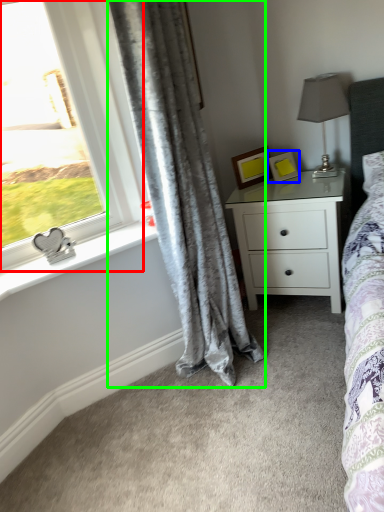
Question: Estimate the real-world distances between objects in this image. Which object is closer to window (highlighted by a red box), picture frame (highlighted by a blue box) or curtain (highlighted by a green box)?

Choices:
 (A) picture frame
 (B) curtain

Answer: (B)